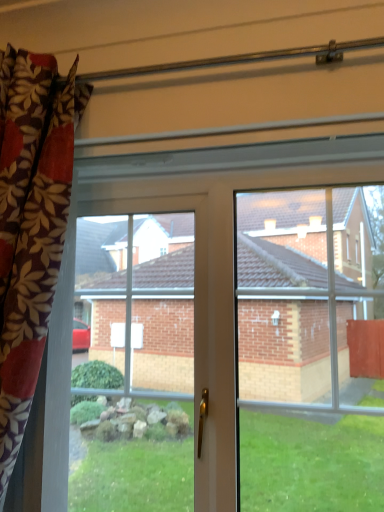
The height and width of the screenshot is (512, 384). I want to click on patterned fabric curtain at left, so click(x=30, y=227).

Image resolution: width=384 pixels, height=512 pixels. What do you see at coordinates (30, 227) in the screenshot? I see `patterned fabric curtain at left` at bounding box center [30, 227].

This screenshot has height=512, width=384. I want to click on patterned fabric curtain at left, so click(30, 227).